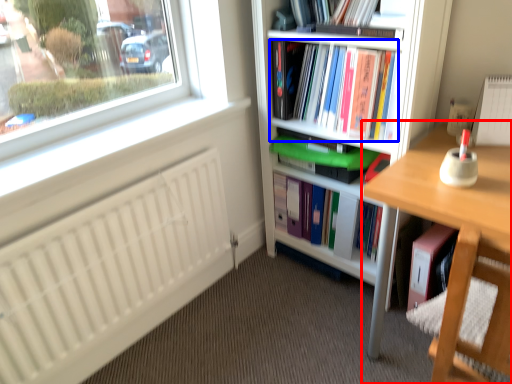
Question: Which object appears closest to the camera in this image, desk (highlighted by a red box) or book (highlighted by a blue box)?

Choices:
 (A) desk
 (B) book

Answer: (A)